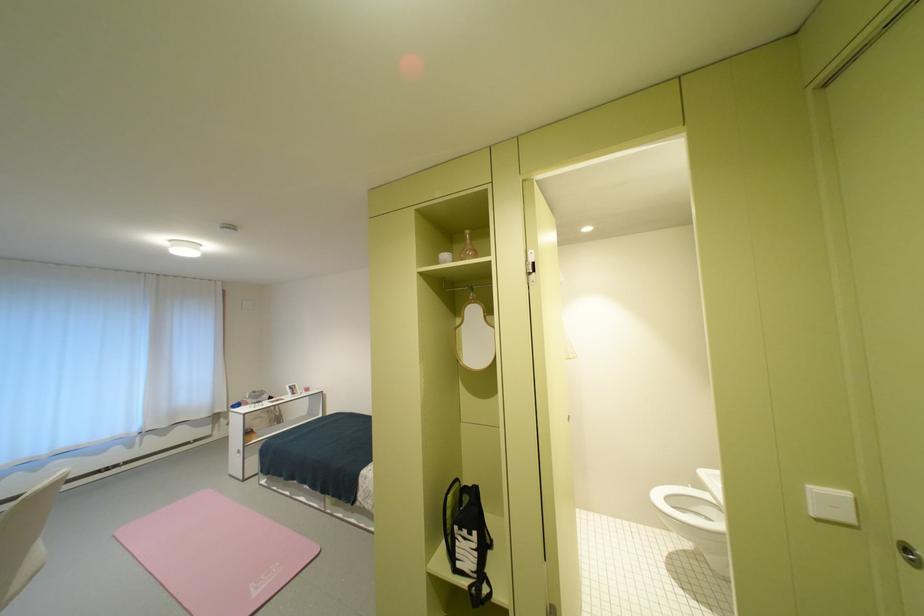
You are a GUI agent. You are given a task and a screenshot of the screen. Output one action in this format:
    pyautogui.click(x=<x>, y=<y>)
    Task: Click on the toilet lid
    
    Given the screenshot: What is the action you would take?
    pyautogui.click(x=711, y=480)